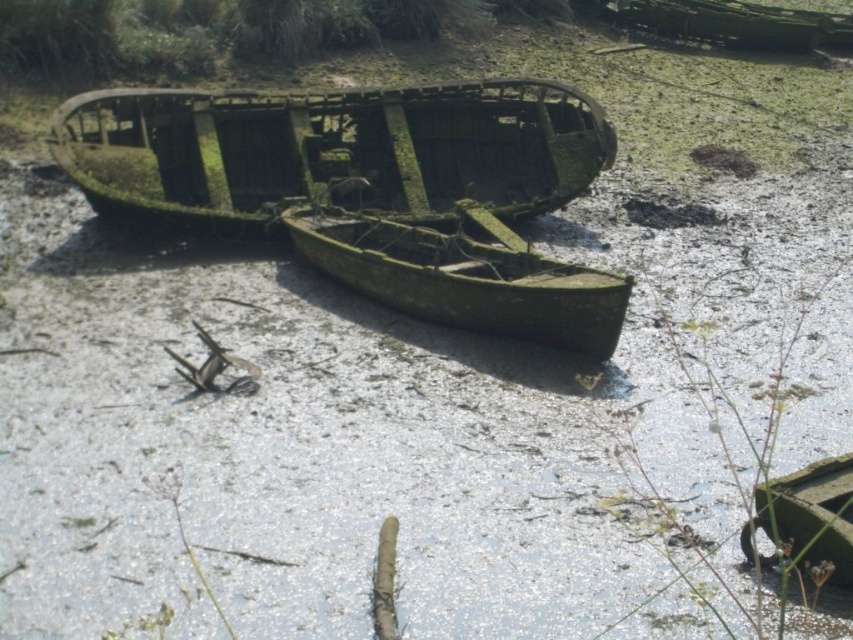
Between green mossy wood boat at center and green mossy wood canoe at center, which one has more height?

With more height is green mossy wood boat at center.

Which is behind, point (125, 104) or point (479, 326)?

The point (125, 104) is behind.

Is point (511, 141) in front of point (339, 241)?

No, it is behind (339, 241).

Where is `green mossy wood boat at center`? The image size is (853, 640). green mossy wood boat at center is located at coordinates (331, 150).